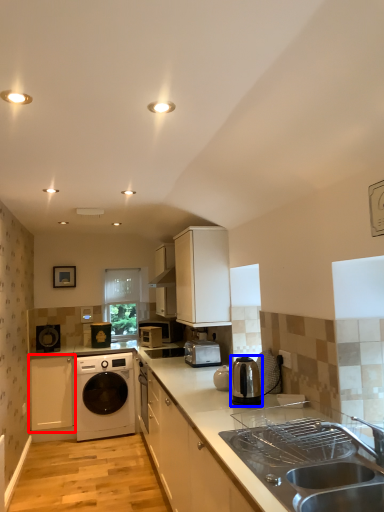
Question: Which of the following is the closest to the observer, cabinetry (highlighted by a red box) or home appliance (highlighted by a blue box)?

Choices:
 (A) cabinetry
 (B) home appliance

Answer: (B)